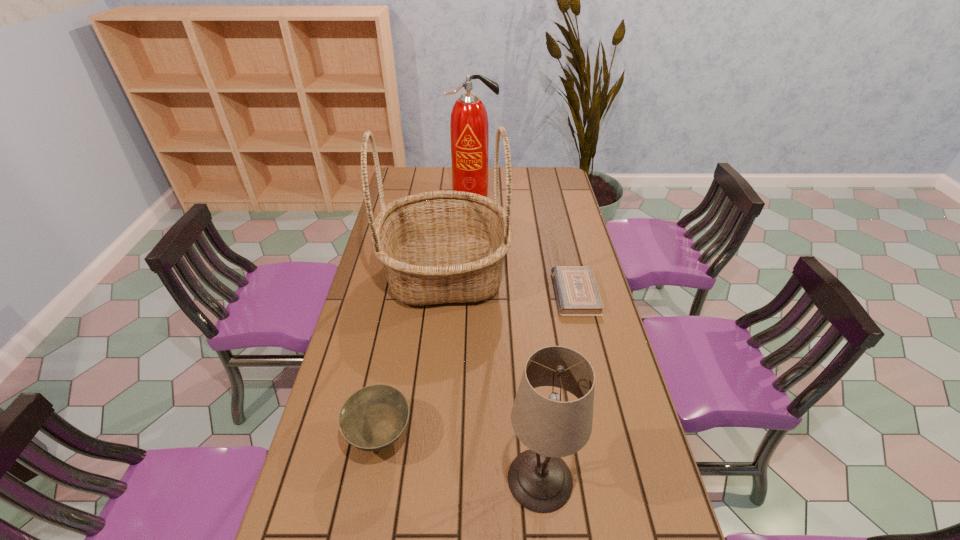
Find the location of a particular element. The height and width of the screenshot is (540, 960). vacant area at the left edge of the desktop is located at coordinates (341, 375).

The height and width of the screenshot is (540, 960). In order to click on blank space at the right edge of the desktop in this screenshot , I will do `click(549, 207)`.

You are a GUI agent. You are given a task and a screenshot of the screen. Output one action in this format:
    pyautogui.click(x=<x>, y=<y>)
    Task: Click on the free space at the far left corner of the desktop
    
    Given the screenshot: What is the action you would take?
    (420, 177)

The width and height of the screenshot is (960, 540). I want to click on free area in between the farthest object and the fourth tallest object, so click(426, 315).

You are a GUI agent. You are given a task and a screenshot of the screen. Output one action in this format:
    pyautogui.click(x=<x>, y=<y>)
    Task: Click on the unoccupied area between the Bible and the bowl
    This screenshot has height=540, width=960.
    Given the screenshot: What is the action you would take?
    pyautogui.click(x=478, y=365)

At what (x,y) coordinates should I click in order to perform the action: click on unoccupied area between the Bible and the basket. Please return your answer as a coordinate pair (x, y). The height and width of the screenshot is (540, 960). Looking at the image, I should click on (510, 284).

Locate an element on the screen. Image resolution: width=960 pixels, height=540 pixels. vacant area between the third shortest object and the basket is located at coordinates (492, 376).

Identify the location of free spot between the bowl and the basket. (413, 355).

Locate an element on the screen. blank region between the second shortest object and the fire extinguisher is located at coordinates (426, 315).

At what (x,y) coordinates should I click in order to perform the action: click on vacant point located between the basket and the second shortest object. Please return your answer as a coordinate pair (x, y). The width and height of the screenshot is (960, 540). Looking at the image, I should click on (413, 355).